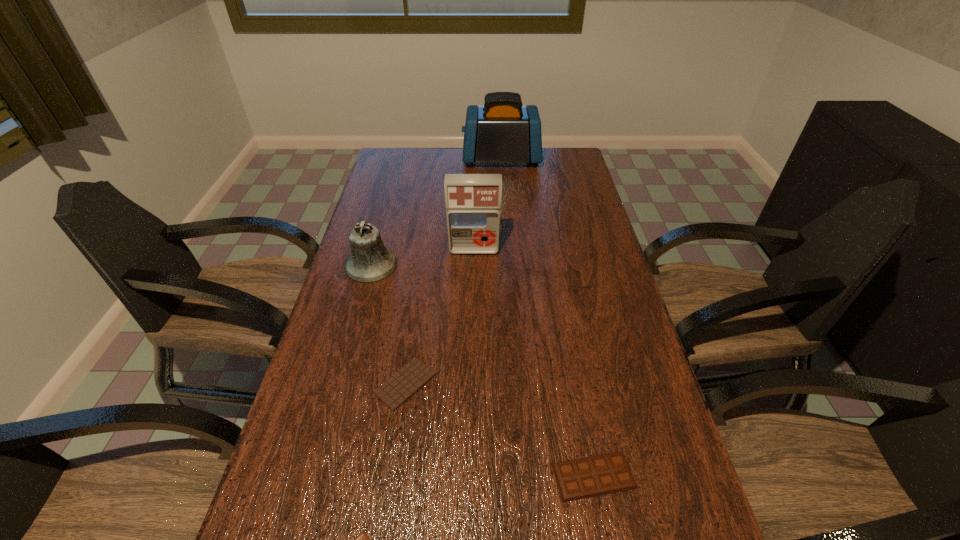
I want to click on free space located on the front-facing side of the first-aid kit, so click(x=473, y=288).

At what (x,y) coordinates should I click in order to perform the action: click on free location located 0.140m on the front of the bell. Please return your answer as a coordinate pair (x, y). Image resolution: width=960 pixels, height=540 pixels. Looking at the image, I should click on (356, 319).

What are the coordinates of `free space located on the back of the second nearest object` in the screenshot? It's located at (565, 322).

I want to click on blank space located 0.170m on the front of the second shortest chocolate bar, so pos(390,490).

Where is `object present at the far edge`? The image size is (960, 540). object present at the far edge is located at coordinates (503, 130).

Find the location of a particular element. bell situated at the left edge is located at coordinates (370, 261).

You are a GUI agent. You are given a task and a screenshot of the screen. Output one action in this format:
    pyautogui.click(x=<x>, y=<y>)
    Task: Click on the chocolate bar located in the left edge section of the desktop
    
    Given the screenshot: What is the action you would take?
    pyautogui.click(x=394, y=392)

This screenshot has width=960, height=540. Find the location of `toaster that is at the right edge`. toaster that is at the right edge is located at coordinates (503, 130).

Where is `chocolate bar located in the right edge section of the desktop`? chocolate bar located in the right edge section of the desktop is located at coordinates (598, 475).

Find the location of a particular element. object that is positioned at the far right corner is located at coordinates (503, 130).